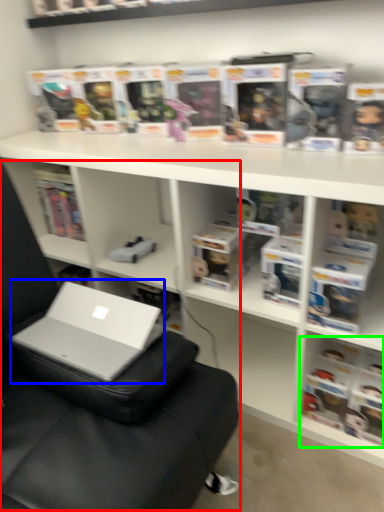
Question: Which object is the farthest from bean bag chair (highlighted by a red box)? Choose among these: laptop (highlighted by a blue box) or book (highlighted by a green box).

Choices:
 (A) laptop
 (B) book

Answer: (B)